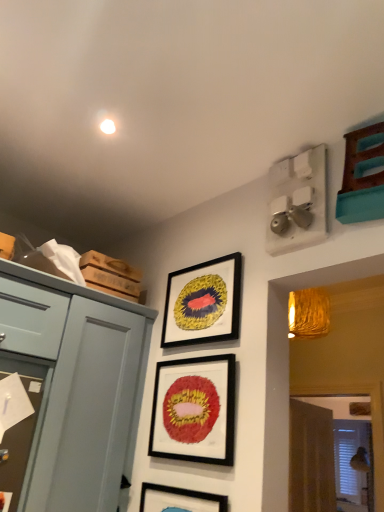
Question: Considering the relative sizes of matte black picture frame at center, which ranks as the 3th picture frame in top-to-bottom order, and matte black picture frame at upper center, the third picture frame in the bottom-to-top sequence, in the image provided, is matte black picture frame at center, which ranks as the 3th picture frame in top-to-bottom order, taller than matte black picture frame at upper center, the third picture frame in the bottom-to-top sequence,?

Choices:
 (A) no
 (B) yes

Answer: (B)

Question: Does matte black picture frame at center, which ranks as the 3th picture frame in top-to-bottom order, have a greater width compared to matte black picture frame at upper center, the third picture frame in the bottom-to-top sequence?

Choices:
 (A) yes
 (B) no

Answer: (B)

Question: From the image's perspective, is matte black picture frame at center, which ranks as the 3th picture frame in top-to-bottom order, above matte black picture frame at upper center, the third picture frame in the bottom-to-top sequence?

Choices:
 (A) yes
 (B) no

Answer: (B)

Question: Is matte black picture frame at center, placed as the 1th picture frame when sorted from bottom to top, not inside matte black picture frame at upper center, the third picture frame in the bottom-to-top sequence?

Choices:
 (A) no
 (B) yes

Answer: (B)

Question: Is matte black picture frame at center, which ranks as the 3th picture frame in top-to-bottom order, far away from matte black picture frame at upper center, which appears as the 1th picture frame when viewed from the top?

Choices:
 (A) no
 (B) yes

Answer: (A)

Question: Considering the relative sizes of matte black picture frame at center, placed as the 1th picture frame when sorted from bottom to top, and matte black picture frame at upper center, the third picture frame in the bottom-to-top sequence, in the image provided, is matte black picture frame at center, placed as the 1th picture frame when sorted from bottom to top, thinner than matte black picture frame at upper center, the third picture frame in the bottom-to-top sequence,?

Choices:
 (A) no
 (B) yes

Answer: (B)

Question: Does matte blue drawer at left appear on the right side of matte blue cabinet at left?

Choices:
 (A) no
 (B) yes

Answer: (A)

Question: Is the surface of matte blue drawer at left in direct contact with matte blue cabinet at left?

Choices:
 (A) no
 (B) yes

Answer: (A)

Question: Does matte blue drawer at left have a lesser height compared to matte blue cabinet at left?

Choices:
 (A) yes
 (B) no

Answer: (A)

Question: Does matte blue drawer at left have a lesser width compared to matte blue cabinet at left?

Choices:
 (A) no
 (B) yes

Answer: (B)

Question: Can you confirm if matte blue drawer at left is wider than matte blue cabinet at left?

Choices:
 (A) yes
 (B) no

Answer: (B)

Question: Can you confirm if matte blue drawer at left is positioned to the left of matte blue cabinet at left?

Choices:
 (A) yes
 (B) no

Answer: (A)

Question: Can you confirm if matte black picture frame at upper center, the third picture frame in the bottom-to-top sequence, is smaller than matte blue cabinet at left?

Choices:
 (A) no
 (B) yes

Answer: (B)